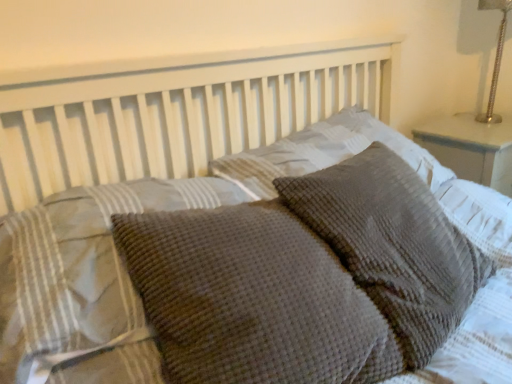
Image resolution: width=512 pixels, height=384 pixels. What do you see at coordinates (252, 299) in the screenshot?
I see `woolen textured pillow at center, positioned as the third pillow in right-to-left order` at bounding box center [252, 299].

Where is `waffle-textured gray pillow at center, the 2th pillow when ordered from right to left`? Image resolution: width=512 pixels, height=384 pixels. waffle-textured gray pillow at center, the 2th pillow when ordered from right to left is located at coordinates coord(324,153).

The width and height of the screenshot is (512, 384). Find the location of `silver metallic lamp at upper right`. silver metallic lamp at upper right is located at coordinates (495, 57).

I want to click on woolen textured pillow at center, positioned as the third pillow in right-to-left order, so click(252, 299).

Is waffle-textured gray pillow at center, the 2th pillow when ordered from right to left, oriented away from waffle-textured gray pillow at center, which ranks as the 4th pillow in right-to-left order?

No.

Which of these two, waffle-textured gray pillow at center, the third pillow viewed from the left, or waffle-textured gray pillow at center, the 1th pillow viewed from the left, is thinner?

waffle-textured gray pillow at center, the 1th pillow viewed from the left, is thinner.

Considering the relative positions of waffle-textured gray pillow at center, the third pillow viewed from the left, and waffle-textured gray pillow at center, which ranks as the 4th pillow in right-to-left order, in the image provided, is waffle-textured gray pillow at center, the third pillow viewed from the left, to the left of waffle-textured gray pillow at center, which ranks as the 4th pillow in right-to-left order, from the viewer's perspective?

In fact, waffle-textured gray pillow at center, the third pillow viewed from the left, is to the right of waffle-textured gray pillow at center, which ranks as the 4th pillow in right-to-left order.

From a real-world perspective, which object stands above the other?

In real-world perspective, waffle-textured gray pillow at center, the 2th pillow when ordered from right to left, is above.

Does waffle-textured gray pillow at center, the 1th pillow viewed from the left, come behind waffle-textured gray pillow at center, the 2th pillow when ordered from right to left?

No, waffle-textured gray pillow at center, the 1th pillow viewed from the left, is closer to the camera.

In the scene shown: From the image's perspective, between waffle-textured gray pillow at center, which ranks as the 4th pillow in right-to-left order, and waffle-textured gray pillow at center, the 2th pillow when ordered from right to left, who is located below?

waffle-textured gray pillow at center, which ranks as the 4th pillow in right-to-left order, is shown below in the image.

Is waffle-textured gray pillow at center, which ranks as the 4th pillow in right-to-left order, directly adjacent to waffle-textured gray pillow at center, the 2th pillow when ordered from right to left?

waffle-textured gray pillow at center, which ranks as the 4th pillow in right-to-left order, and waffle-textured gray pillow at center, the 2th pillow when ordered from right to left, are clearly separated.

Looking at this image, which is more to the left, waffle-textured gray pillow at center, the third pillow viewed from the left, or waffle-textured gray pillow at center, which is counted as the 1th pillow, starting from the right?

waffle-textured gray pillow at center, the third pillow viewed from the left.

Looking at this image, does waffle-textured gray pillow at center, the third pillow viewed from the left, turn towards waffle-textured gray pillow at center, which is counted as the 1th pillow, starting from the right?

Yes, waffle-textured gray pillow at center, the third pillow viewed from the left, is facing waffle-textured gray pillow at center, which is counted as the 1th pillow, starting from the right.

Which object is further away from the camera taking this photo, waffle-textured gray pillow at center, the 2th pillow when ordered from right to left, or waffle-textured gray pillow at center, which is counted as the 1th pillow, starting from the right?

waffle-textured gray pillow at center, the 2th pillow when ordered from right to left, is behind.

Is waffle-textured gray pillow at center, the 2th pillow when ordered from right to left, placed right next to waffle-textured gray pillow at center, which is counted as the 1th pillow, starting from the right?

waffle-textured gray pillow at center, the 2th pillow when ordered from right to left, is not next to waffle-textured gray pillow at center, which is counted as the 1th pillow, starting from the right, and they're not touching.

Where is `pillow that is the 1st object located in front of the waffle-textured gray pillow at center, the fourth pillow viewed from the left`? Image resolution: width=512 pixels, height=384 pixels. pillow that is the 1st object located in front of the waffle-textured gray pillow at center, the fourth pillow viewed from the left is located at coordinates (81, 264).

From the image's perspective, relative to waffle-textured gray pillow at center, the 1th pillow viewed from the left, is waffle-textured gray pillow at center, the fourth pillow viewed from the left, above or below?

waffle-textured gray pillow at center, the fourth pillow viewed from the left, is above waffle-textured gray pillow at center, the 1th pillow viewed from the left.

From a real-world perspective, is waffle-textured gray pillow at center, which is counted as the 1th pillow, starting from the right, positioned over waffle-textured gray pillow at center, which ranks as the 4th pillow in right-to-left order, based on gravity?

Incorrect, from a real-world perspective, waffle-textured gray pillow at center, which is counted as the 1th pillow, starting from the right, is lower than waffle-textured gray pillow at center, which ranks as the 4th pillow in right-to-left order.

Between waffle-textured gray pillow at center, the fourth pillow viewed from the left, and waffle-textured gray pillow at center, the 1th pillow viewed from the left, which one is positioned behind?

waffle-textured gray pillow at center, the fourth pillow viewed from the left, is behind.

From the image's perspective, count 3rd pillows downward from the silver metallic lamp at upper right and point to it. Please provide its 2D coordinates.

[(81, 264)]

Considering the sizes of objects waffle-textured gray pillow at center, the 1th pillow viewed from the left, and silver metallic lamp at upper right in the image provided, who is bigger, waffle-textured gray pillow at center, the 1th pillow viewed from the left, or silver metallic lamp at upper right?

A: With larger size is waffle-textured gray pillow at center, the 1th pillow viewed from the left.

In the image, is waffle-textured gray pillow at center, which ranks as the 4th pillow in right-to-left order, on the left side or the right side of silver metallic lamp at upper right?

In the image, waffle-textured gray pillow at center, which ranks as the 4th pillow in right-to-left order, appears on the left side of silver metallic lamp at upper right.

From the image's perspective, which one is positioned lower, waffle-textured gray pillow at center, the 1th pillow viewed from the left, or silver metallic lamp at upper right?

waffle-textured gray pillow at center, the 1th pillow viewed from the left, is shown below in the image.

Consider the image. Would you say silver metallic lamp at upper right is a long distance from waffle-textured gray pillow at center, the 2th pillow when ordered from right to left?

silver metallic lamp at upper right is near waffle-textured gray pillow at center, the 2th pillow when ordered from right to left, not far away.

From the image's perspective, between silver metallic lamp at upper right and waffle-textured gray pillow at center, the third pillow viewed from the left, which one is located above?

silver metallic lamp at upper right appears higher in the image.

Can you confirm if silver metallic lamp at upper right is shorter than waffle-textured gray pillow at center, the third pillow viewed from the left?

No.

From a real-world perspective, is silver metallic lamp at upper right on waffle-textured gray pillow at center, the third pillow viewed from the left?

Yes.

Is silver metallic lamp at upper right positioned with its back to woolen textured pillow at center, the 2th pillow positioned from the left?

No, silver metallic lamp at upper right is not facing the opposite direction of woolen textured pillow at center, the 2th pillow positioned from the left.

In the image, is silver metallic lamp at upper right positioned in front of or behind woolen textured pillow at center, the 2th pillow positioned from the left?

silver metallic lamp at upper right is positioned farther from the viewer than woolen textured pillow at center, the 2th pillow positioned from the left.

From the picture: Visually, is silver metallic lamp at upper right positioned to the left or to the right of woolen textured pillow at center, positioned as the third pillow in right-to-left order?

Based on their positions, silver metallic lamp at upper right is located to the right of woolen textured pillow at center, positioned as the third pillow in right-to-left order.

What's the angular difference between silver metallic lamp at upper right and woolen textured pillow at center, positioned as the third pillow in right-to-left order,'s facing directions?

The angle between the facing direction of silver metallic lamp at upper right and the facing direction of woolen textured pillow at center, positioned as the third pillow in right-to-left order, is 8.53 degrees.

There is a waffle-textured gray pillow at center, the 2th pillow when ordered from right to left. At what (x,y) coordinates should I click in order to perform the action: click on the 2nd pillow below it (from the image's perspective). Please return your answer as a coordinate pair (x, y). Looking at the image, I should click on (81, 264).

I want to click on the 2nd pillow behind the waffle-textured gray pillow at center, which ranks as the 4th pillow in right-to-left order, so (x=324, y=153).

From the image, which object appears to be nearer to woolen textured pillow at center, the 2th pillow positioned from the left, silver metallic lamp at upper right or waffle-textured gray pillow at center, the 1th pillow viewed from the left?

waffle-textured gray pillow at center, the 1th pillow viewed from the left, lies closer to woolen textured pillow at center, the 2th pillow positioned from the left, than the other object.

From the image, which object appears to be nearer to waffle-textured gray pillow at center, which is counted as the 1th pillow, starting from the right, waffle-textured gray pillow at center, the 1th pillow viewed from the left, or woolen textured pillow at center, the 2th pillow positioned from the left?

woolen textured pillow at center, the 2th pillow positioned from the left, lies closer to waffle-textured gray pillow at center, which is counted as the 1th pillow, starting from the right, than the other object.

Considering their positions, is waffle-textured gray pillow at center, which is counted as the 1th pillow, starting from the right, positioned further to woolen textured pillow at center, the 2th pillow positioned from the left, than waffle-textured gray pillow at center, the third pillow viewed from the left?

waffle-textured gray pillow at center, the third pillow viewed from the left, is positioned further to the anchor woolen textured pillow at center, the 2th pillow positioned from the left.

Considering their positions, is silver metallic lamp at upper right positioned further to waffle-textured gray pillow at center, the fourth pillow viewed from the left, than waffle-textured gray pillow at center, the 2th pillow when ordered from right to left?

silver metallic lamp at upper right is further to waffle-textured gray pillow at center, the fourth pillow viewed from the left.

Which object lies further to the anchor point waffle-textured gray pillow at center, the 2th pillow when ordered from right to left, waffle-textured gray pillow at center, which ranks as the 4th pillow in right-to-left order, or waffle-textured gray pillow at center, the fourth pillow viewed from the left?

waffle-textured gray pillow at center, which ranks as the 4th pillow in right-to-left order, lies further to waffle-textured gray pillow at center, the 2th pillow when ordered from right to left, than the other object.

From the image, which object appears to be farther from woolen textured pillow at center, the 2th pillow positioned from the left, waffle-textured gray pillow at center, which ranks as the 4th pillow in right-to-left order, or silver metallic lamp at upper right?

Among the two, silver metallic lamp at upper right is located further to woolen textured pillow at center, the 2th pillow positioned from the left.

Looking at the image, which one is located closer to waffle-textured gray pillow at center, which is counted as the 1th pillow, starting from the right, woolen textured pillow at center, positioned as the third pillow in right-to-left order, or waffle-textured gray pillow at center, the third pillow viewed from the left?

woolen textured pillow at center, positioned as the third pillow in right-to-left order, lies closer to waffle-textured gray pillow at center, which is counted as the 1th pillow, starting from the right, than the other object.

Estimate the real-world distances between objects in this image. Which object is closer to waffle-textured gray pillow at center, the third pillow viewed from the left, silver metallic lamp at upper right or woolen textured pillow at center, the 2th pillow positioned from the left?

woolen textured pillow at center, the 2th pillow positioned from the left, lies closer to waffle-textured gray pillow at center, the third pillow viewed from the left, than the other object.

This screenshot has width=512, height=384. Find the location of `pillow positioned between waffle-textured gray pillow at center, the fourth pillow viewed from the left, and silver metallic lamp at upper right from near to far`. pillow positioned between waffle-textured gray pillow at center, the fourth pillow viewed from the left, and silver metallic lamp at upper right from near to far is located at coordinates (324, 153).

Find the location of a particular element. pillow between waffle-textured gray pillow at center, the 1th pillow viewed from the left, and waffle-textured gray pillow at center, the 2th pillow when ordered from right to left is located at coordinates (252, 299).